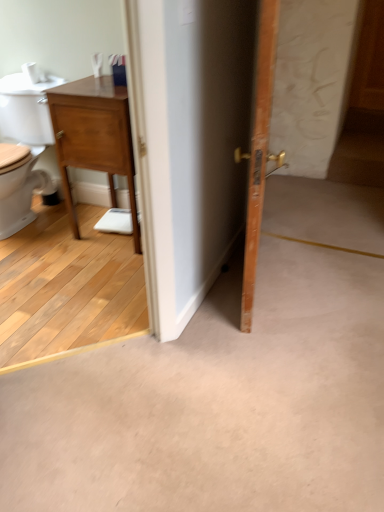
The height and width of the screenshot is (512, 384). Describe the element at coordinates (259, 151) in the screenshot. I see `wooden door at right` at that location.

The width and height of the screenshot is (384, 512). I want to click on wooden door at right, so click(x=259, y=151).

Where is `wooden nightstand at left`? wooden nightstand at left is located at coordinates (94, 137).

The image size is (384, 512). What do you see at coordinates (94, 137) in the screenshot? I see `wooden nightstand at left` at bounding box center [94, 137].

I want to click on wooden door at right, so click(259, 151).

Considering the relative positions of wooden door at right and wooden nightstand at left in the image provided, is wooden door at right to the right of wooden nightstand at left from the viewer's perspective?

Yes.

Relative to wooden nightstand at left, is wooden door at right in front or behind?

In the image, wooden door at right appears in front of wooden nightstand at left.

Is point (266, 157) in front of point (101, 115)?

Yes, point (266, 157) is closer to viewer.

From the image's perspective, is wooden door at right located above wooden nightstand at left?

No, from the image's perspective, wooden door at right is not above wooden nightstand at left.

From a real-world perspective, between wooden door at right and wooden nightstand at left, who is vertically lower?

wooden nightstand at left, from a real-world perspective.

Is wooden door at right thinner than wooden nightstand at left?

Indeed, wooden door at right has a lesser width compared to wooden nightstand at left.

Can you confirm if wooden door at right is shorter than wooden nightstand at left?

In fact, wooden door at right may be taller than wooden nightstand at left.

In the scene shown: Based on their sizes in the image, would you say wooden door at right is bigger or smaller than wooden nightstand at left?

Clearly, wooden door at right is smaller in size than wooden nightstand at left.

Do you think wooden door at right is within wooden nightstand at left, or outside of it?

wooden door at right is not enclosed by wooden nightstand at left.

In the scene shown: Is there a large distance between wooden door at right and wooden nightstand at left?

No, there isn't a large distance between wooden door at right and wooden nightstand at left.

Looking at this image, is wooden door at right oriented towards wooden nightstand at left?

No, wooden door at right is not facing towards wooden nightstand at left.

The width and height of the screenshot is (384, 512). Find the location of `nightstand lying above the wooden door at right (from the image's perspective)`. nightstand lying above the wooden door at right (from the image's perspective) is located at coordinates (94, 137).

Considering the positions of objects wooden nightstand at left and wooden door at right in the image provided, who is more to the left, wooden nightstand at left or wooden door at right?

wooden nightstand at left is more to the left.

Which is in front, wooden nightstand at left or wooden door at right?

wooden door at right.

Is point (108, 140) in front of point (272, 3)?

No.

From the image's perspective, is wooden nightstand at left under wooden door at right?

No, from the image's perspective, wooden nightstand at left is not below wooden door at right.

From a real-world perspective, is wooden nightstand at left positioned above or below wooden door at right?

Clearly, from a real-world perspective, wooden nightstand at left is below wooden door at right.

From the picture: Which of these two, wooden nightstand at left or wooden door at right, is wider?

With larger width is wooden nightstand at left.

Is wooden nightstand at left shorter than wooden door at right?

Correct, wooden nightstand at left is not as tall as wooden door at right.

Considering the sizes of objects wooden nightstand at left and wooden door at right in the image provided, who is bigger, wooden nightstand at left or wooden door at right?

wooden nightstand at left.

From the picture: Is wooden nightstand at left inside the boundaries of wooden door at right, or outside?

wooden nightstand at left exists outside the volume of wooden door at right.

Would you consider wooden nightstand at left to be distant from wooden door at right?

wooden nightstand at left is near wooden door at right, not far away.

Consider the image. Is wooden nightstand at left oriented towards wooden door at right?

No, wooden nightstand at left is not aimed at wooden door at right.

In the image, there is a wooden door at right. Where is `nightstand above it (from the image's perspective)`? Image resolution: width=384 pixels, height=512 pixels. nightstand above it (from the image's perspective) is located at coordinates (94, 137).

Locate an element on the screen. door on the right side of wooden nightstand at left is located at coordinates (259, 151).

The height and width of the screenshot is (512, 384). I want to click on door below the wooden nightstand at left (from the image's perspective), so click(x=259, y=151).